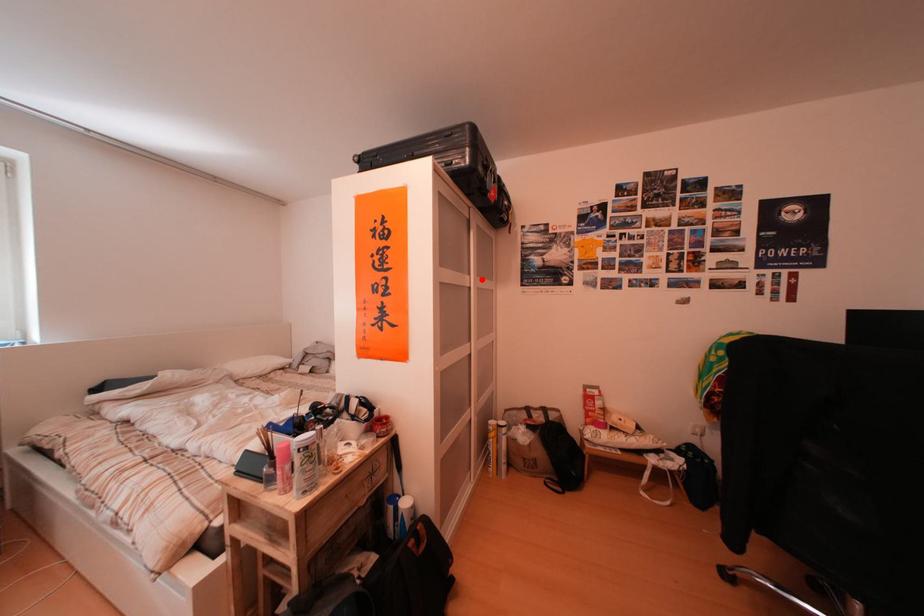
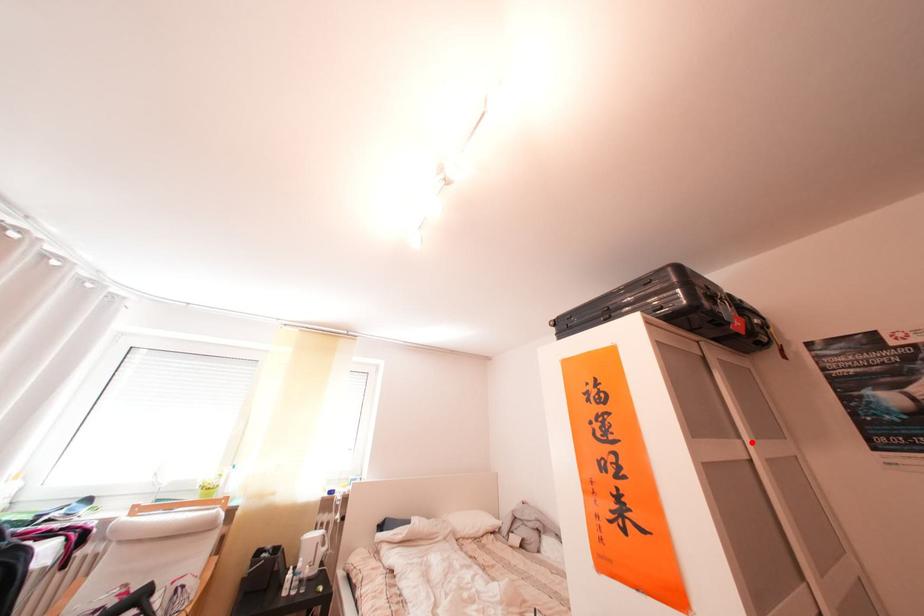
I am providing you with two images of the same scene from different viewpoints. A red point is marked on the first image and another point is marked on the second image. Is the red point in image1 aligned with the point shown in image2?

Yes